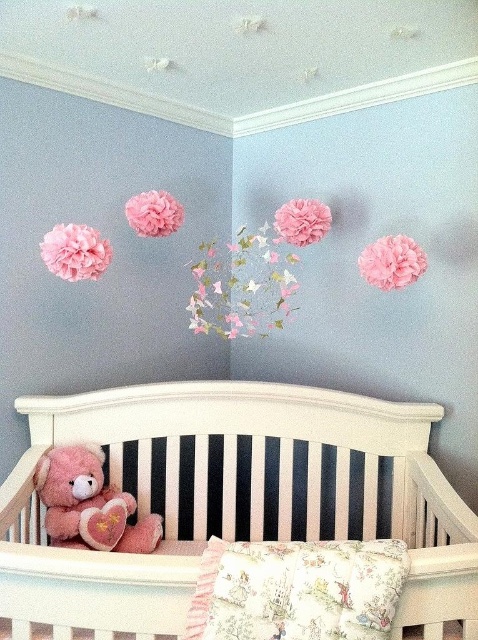
You are standing in the nursery and want to place a small toy between the two points labeled point (201, 326) and point (372, 259). Which point is closer to you where you should place the toy?

Point (201, 326) is closer to you than point (372, 259), so you should place the toy near point (201, 326).